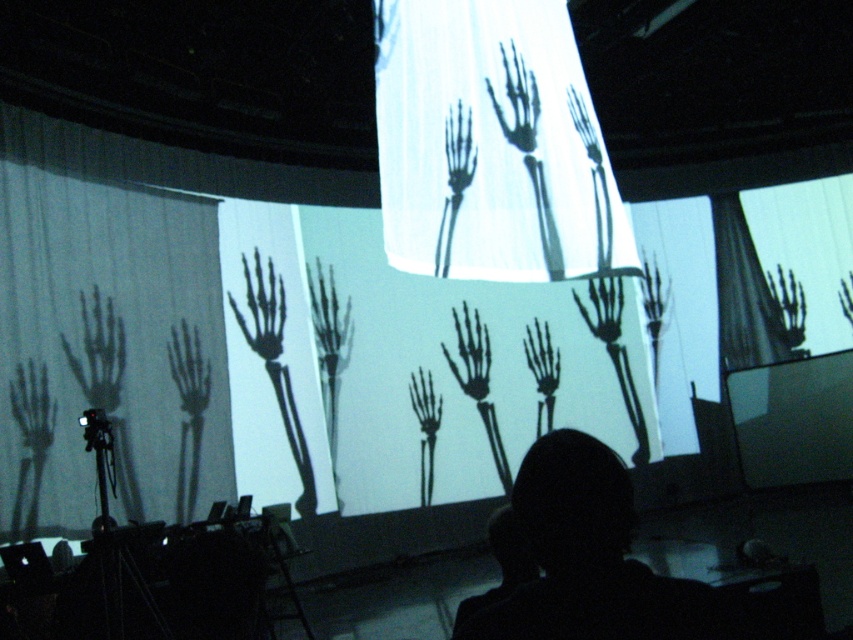
You are an event organizer setting up a spooky Halloween display. You have a black hair at lower center and a transparent plastic skeleton hand at upper center in your setup. Based on their positions, which object is closer to the left side of the display?

The black hair at lower center is to the left of the transparent plastic skeleton hand at upper center, so it is closer to the left side of the display.

You are standing in front of the screen displaying skeletal hand projections. You want to know how far the point at coordinates point (610, 509) is from you. Can you determine the distance?

The point (610, 509) is 3.94 feet away from the viewer.

You are an observer looking at the skeletal hand projections on the screen. There are two points marked on the screen at coordinates point (454,122) and point (595,227). Which point appears closer to you?

Point (454,122) is closer to the camera than point (595,227), so it appears closer to you.